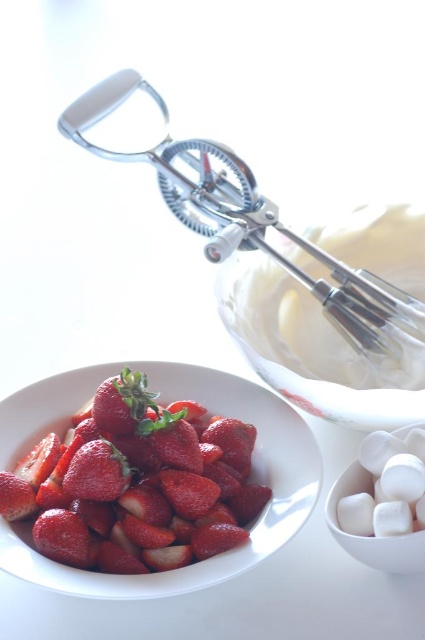
Question: Can you confirm if smooth matte white bowl at lower left is positioned to the right of red matte strawberry at lower left?

Choices:
 (A) no
 (B) yes

Answer: (B)

Question: Is metallic whisk at upper center below red matte strawberry at lower left?

Choices:
 (A) no
 (B) yes

Answer: (A)

Question: Among these points, which one is nearest to the camera?

Choices:
 (A) (294, 524)
 (B) (19, 512)
 (C) (289, 243)

Answer: (A)

Question: Which object is positioned farthest from the metallic whisk at upper center?

Choices:
 (A) white matte marshmallows at lower right
 (B) smooth matte white bowl at lower left
 (C) red matte strawberry at lower left
 (D) glossy red strawberry at center

Answer: (C)

Question: Which point is farther to the camera?

Choices:
 (A) metallic whisk at upper center
 (B) smooth matte white bowl at lower left
 (C) white matte marshmallows at lower right
 (D) clear glass bowl at upper center

Answer: (A)

Question: Does smooth matte white bowl at lower left appear on the left side of white matte marshmallows at lower right?

Choices:
 (A) no
 (B) yes

Answer: (B)